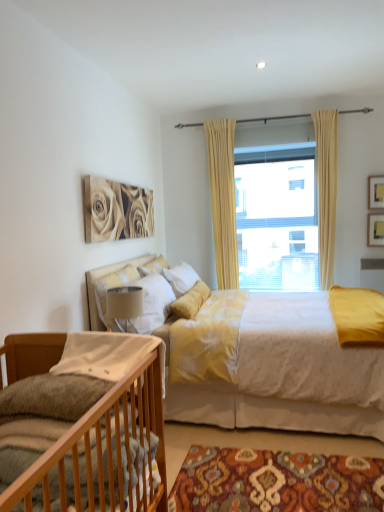
You are a GUI agent. You are given a task and a screenshot of the screen. Output one action in this format:
    pyautogui.click(x=<x>, y=<y>)
    Task: Click on the empty space that is ontop of patterned carpet at lower center (from a real-world perspective)
    This screenshot has height=512, width=384.
    Given the screenshot: What is the action you would take?
    pyautogui.click(x=270, y=462)